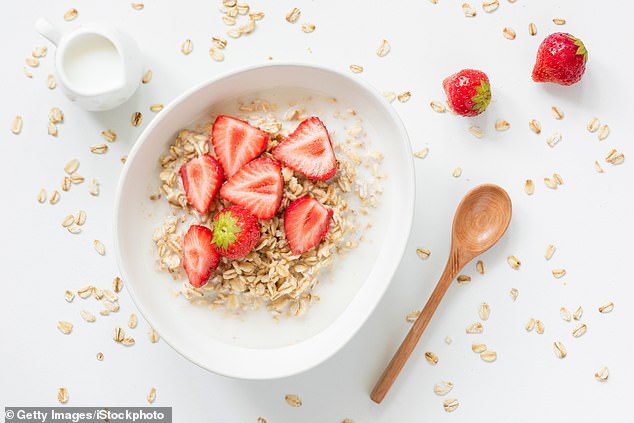
This screenshot has width=634, height=423. I want to click on spoon, so click(475, 238).